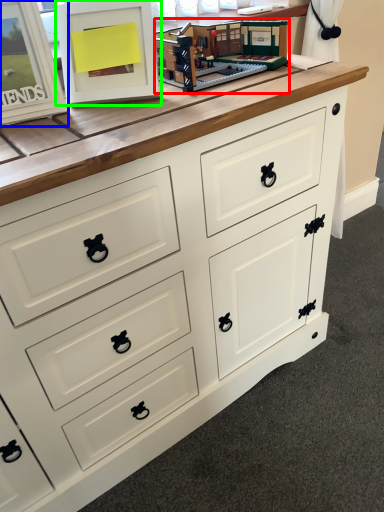
Question: Considering the real-world distances, which object is closest to toy (highlighted by a red box)? picture frame (highlighted by a blue box) or picture frame (highlighted by a green box).

Choices:
 (A) picture frame
 (B) picture frame

Answer: (B)